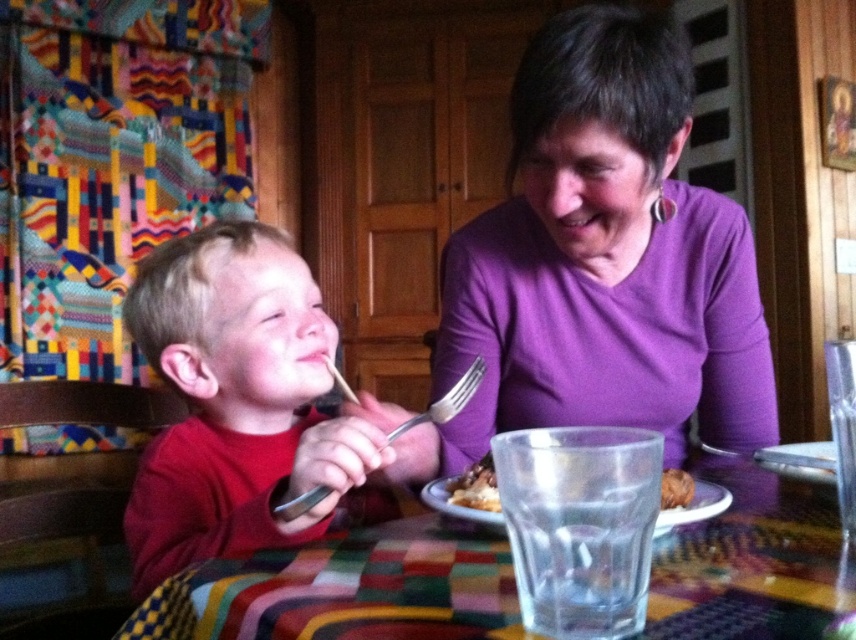
Does purple matte shirt at upper center have a lesser width compared to white ceramic plate at center?

In fact, purple matte shirt at upper center might be wider than white ceramic plate at center.

Is purple matte shirt at upper center shorter than white ceramic plate at center?

No.

Is point (626, 132) closer to camera compared to point (461, 506)?

No.

At what (x,y) coordinates should I click in order to perform the action: click on purple matte shirt at upper center. Please return your answer as a coordinate pair (x, y). Looking at the image, I should click on (604, 259).

Does clear glass at center have a smaller size compared to brown crumbly bread at lower center?

No, clear glass at center is not smaller than brown crumbly bread at lower center.

Find the location of a particular element. clear glass at center is located at coordinates (476, 486).

Where is `clear glass at center`? This screenshot has width=856, height=640. clear glass at center is located at coordinates tap(476, 486).

Does point (484, 502) lie behind point (682, 490)?

No.

Is golden brown crumbly pastry at lower center positioned at the back of brown crumbly bread at lower center?

No.

Who is more forward, (488, 470) or (685, 492)?

Point (685, 492) is more forward.

Identify the location of golden brown crumbly pastry at lower center. (477, 486).